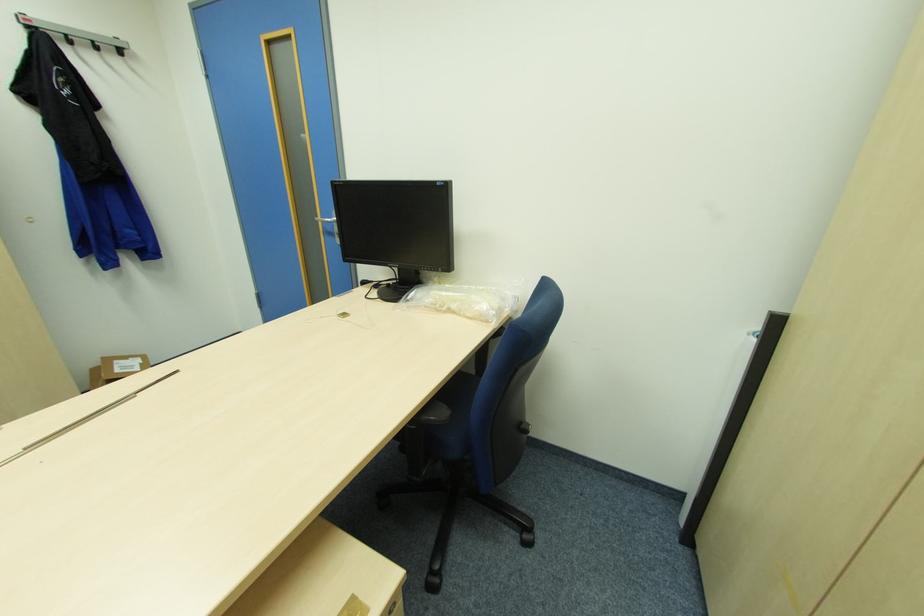
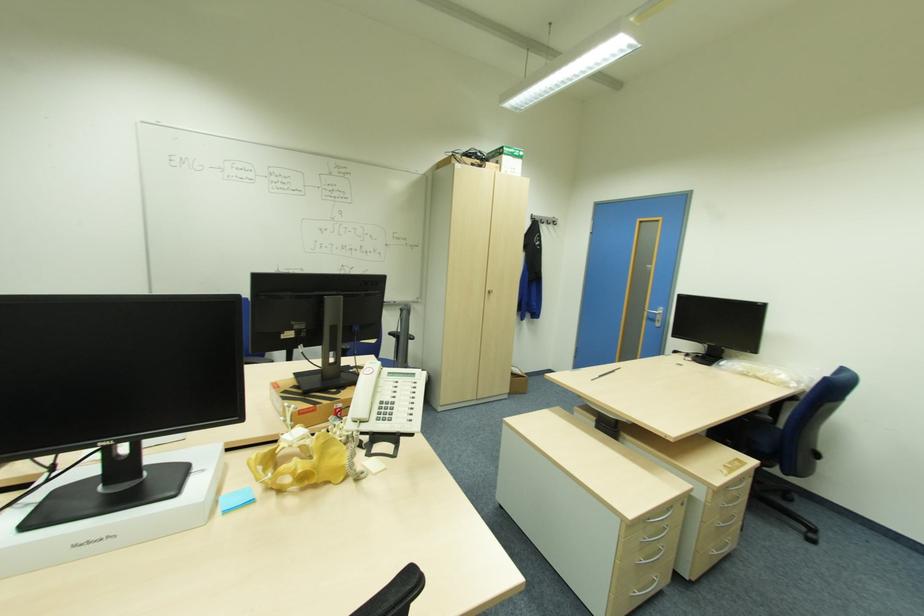
Locate, in the second image, the point that corresponds to point 417,427 in the first image.

(750, 419)